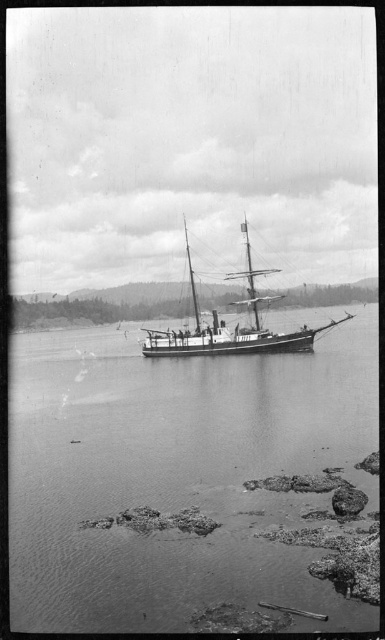
Find the location of `smooth water at center`. smooth water at center is located at coordinates (177, 474).

Does smooth water at center appear on the right side of wooden ship at center?

Indeed, smooth water at center is positioned on the right side of wooden ship at center.

Between point (172, 544) and point (212, 355), which one is positioned behind?

Point (212, 355)

I want to click on smooth water at center, so click(177, 474).